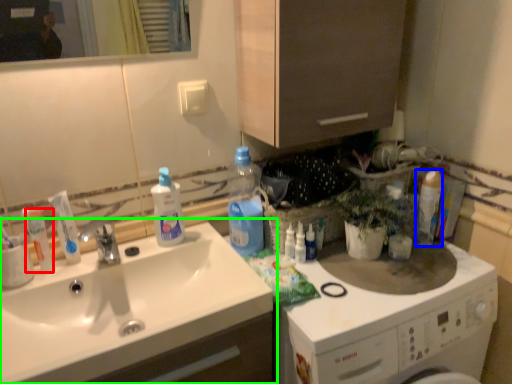
Question: Considering the real-world distances, which object is farthest from toiletry (highlighted by a red box)? cleaning product (highlighted by a blue box) or sink (highlighted by a green box)?

Choices:
 (A) cleaning product
 (B) sink

Answer: (A)